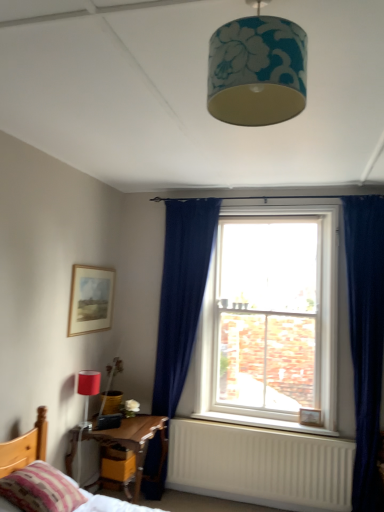
Where is `free space above white painted wood at lower center (from a real-world perspective)`? The height and width of the screenshot is (512, 384). free space above white painted wood at lower center (from a real-world perspective) is located at coordinates (263, 422).